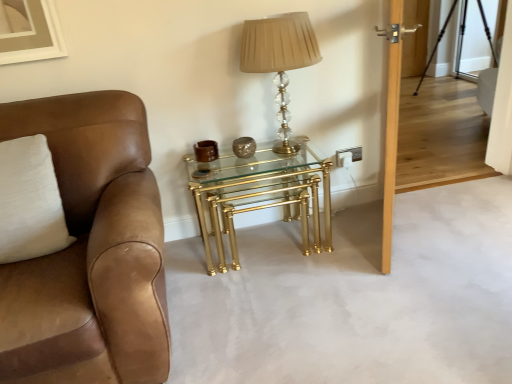
Question: From a real-world perspective, is transparent glass door at upper right, the second glass door viewed from the left, above or below white soft pillow at left?

Choices:
 (A) below
 (B) above

Answer: (A)

Question: In the image, is transparent glass door at upper right, the second glass door viewed from the left, on the left side or the right side of white soft pillow at left?

Choices:
 (A) left
 (B) right

Answer: (B)

Question: Estimate the real-world distances between objects in this image. Which object is farther from the gold metallic nesting tables at center?

Choices:
 (A) white soft pillow at left
 (B) brown leather chair at left
 (C) translucent crystal table lamp at upper center
 (D) transparent glass door at upper right, the second glass door viewed from the left
 (E) clear glass door at upper right, the second glass door positioned from the right

Answer: (E)

Question: Estimate the real-world distances between objects in this image. Which object is farther from the gold metallic nesting tables at center?

Choices:
 (A) clear glass door at upper right, the second glass door positioned from the right
 (B) transparent glass door at upper right, which is counted as the first glass door, starting from the right
 (C) white soft pillow at left
 (D) translucent crystal table lamp at upper center
 (E) brown leather chair at left

Answer: (A)